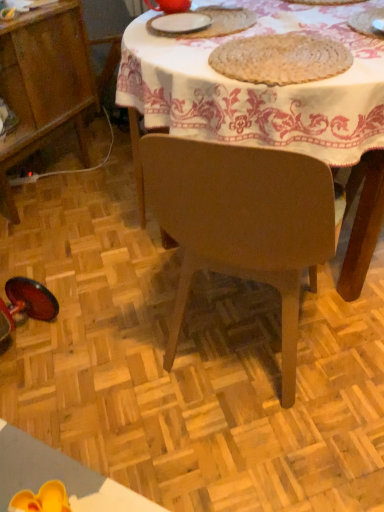
Locate an element on the screen. free region under wooden cabinet at lower left (from a real-world perspective) is located at coordinates (49, 183).